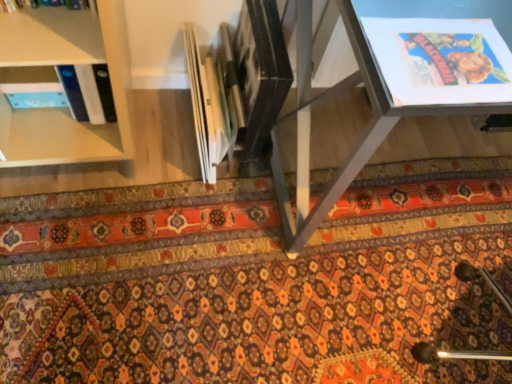
Question: Is carpeted mat at center inside the boundaries of metallic gray table at center, or outside?

Choices:
 (A) inside
 (B) outside

Answer: (B)

Question: From a real-world perspective, relative to metallic gray table at center, is carpeted mat at center vertically above or below?

Choices:
 (A) above
 (B) below

Answer: (B)

Question: From the image's perspective, is carpeted mat at center positioned above or below metallic gray table at center?

Choices:
 (A) below
 (B) above

Answer: (A)

Question: In terms of width, does metallic gray table at center look wider or thinner when compared to carpeted mat at center?

Choices:
 (A) thin
 (B) wide

Answer: (A)

Question: In the image, is metallic gray table at center positioned in front of or behind carpeted mat at center?

Choices:
 (A) front
 (B) behind

Answer: (A)

Question: Choose the correct answer: Is metallic gray table at center inside carpeted mat at center or outside it?

Choices:
 (A) outside
 (B) inside

Answer: (A)

Question: Based on their positions, is metallic gray table at center located to the left or right of carpeted mat at center?

Choices:
 (A) left
 (B) right

Answer: (B)